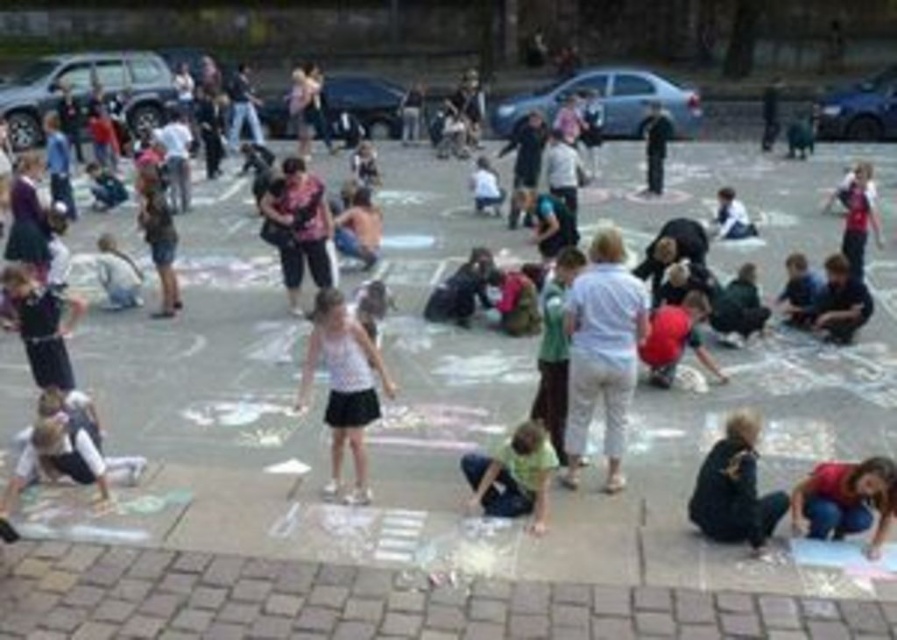
You are a photographer standing at the edge of the square. You want to take a photo that includes both the white cotton shirt at center and the dark brown leather jacket at lower right. Which subject should you focus on first to ensure both are in frame?

You should focus on the white cotton shirt at center first because it is wider than the dark brown leather jacket at lower right, so starting with the wider object ensures the narrower one will fit into the frame.

You are a photographer standing at the edge of the square. You want to capture a photo of the dark brown leather jacket at lower right and the red denim jeans at lower right without any obstructions. Based on their positions, which one is closer to the camera so that you can focus on it first?

The dark brown leather jacket at lower right is wider than the red denim jeans at lower right, so it might be closer to the camera, allowing you to focus on it first.

You are a photographer standing at the edge of the square. You want to capture a photo that includes both the white cotton shirt at center and the red denim jeans at lower right. Which object should you focus on first to ensure both are in the frame?

The white cotton shirt at center is bigger than the red denim jeans at lower right, so you should focus on the white cotton shirt at center first to ensure it fits within the frame, then adjust to include the smaller red denim jeans at lower right.